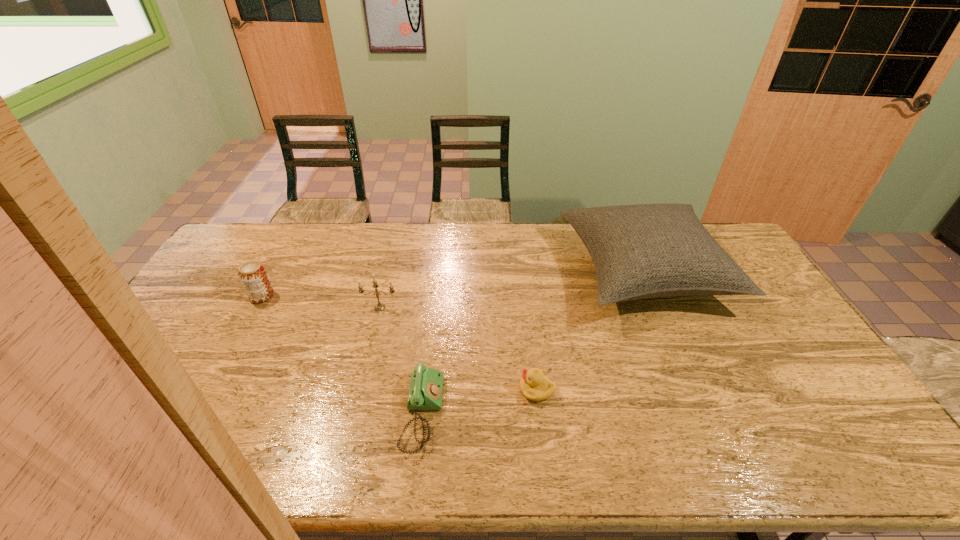
Identify the location of vacant space located 0.360m on the front-facing side of the duckling. (385, 389).

This screenshot has width=960, height=540. Find the location of `vacant space located 0.140m on the front-facing side of the duckling`. vacant space located 0.140m on the front-facing side of the duckling is located at coordinates (467, 389).

Find the location of a particular element. The image size is (960, 540). vacant space located on the dial of the telephone is located at coordinates (532, 413).

I want to click on object that is at the far edge, so click(x=641, y=251).

Where is `object that is positioned at the near edge`? This screenshot has width=960, height=540. object that is positioned at the near edge is located at coordinates (426, 384).

In order to click on object positioned at the right edge in this screenshot , I will do `click(641, 251)`.

At what (x,y) coordinates should I click in order to perform the action: click on object that is at the far right corner. Please return your answer as a coordinate pair (x, y). This screenshot has width=960, height=540. Looking at the image, I should click on (641, 251).

Locate an element on the screen. vacant space at the far edge of the desktop is located at coordinates (408, 247).

What are the coordinates of `vacant region at the near edge` in the screenshot? It's located at (201, 471).

You are a GUI agent. You are given a task and a screenshot of the screen. Output one action in this format:
    pyautogui.click(x=<x>, y=<y>)
    Task: Click on the vacant space at the left edge of the desktop
    
    Given the screenshot: What is the action you would take?
    pyautogui.click(x=135, y=395)